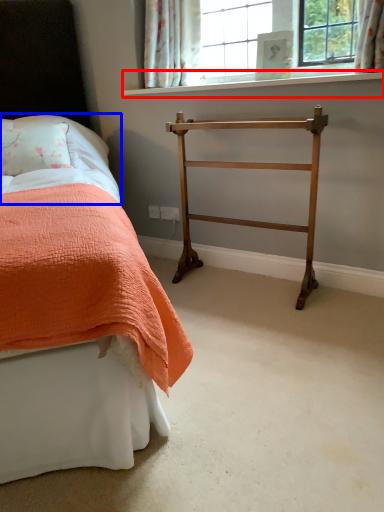
Question: Which object appears closest to the camera in this image, window sill (highlighted by a red box) or sheet (highlighted by a blue box)?

Choices:
 (A) window sill
 (B) sheet

Answer: (A)